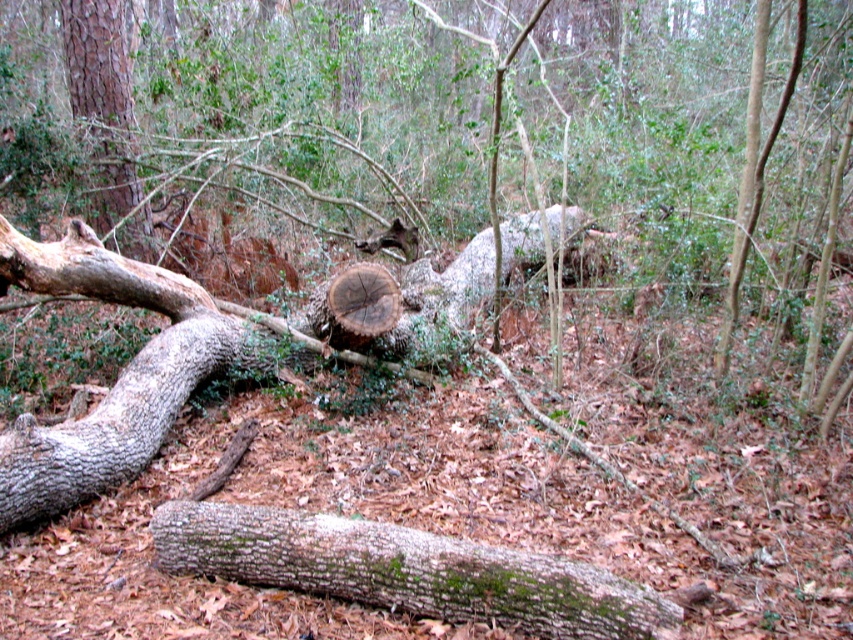
You are a hiker trying to navigate through the forest. You have two landmarks marked on your map as point coordinates. The first is point (228, 561) and the second is point (114, 38). Which point is closer to your current position?

Point (228, 561) is closer to the camera than point (114, 38), so the first point is closer to your current position.

You are a hiker trying to cross the forest floor. You see the green mossy bark log at lower center and the smooth brown tree trunk at upper left. Which object is closer to the ground?

The green mossy bark log at lower center is positioned under the smooth brown tree trunk at upper left, so it is closer to the ground.